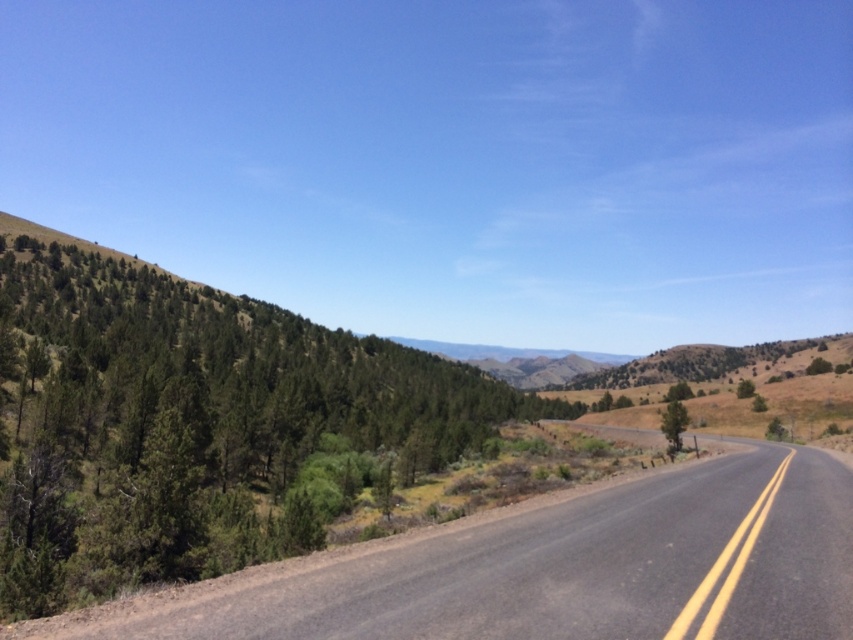
Between point (340, 376) and point (496, 616), which one is positioned in front?

Positioned in front is point (496, 616).

Consider the image. Who is taller, green leafy tree at left or black asphalt road at center?

Standing taller between the two is green leafy tree at left.

Does point (126, 432) come farther from viewer compared to point (747, 632)?

Yes, point (126, 432) is behind point (747, 632).

Find the location of a particular element. green leafy tree at left is located at coordinates (196, 424).

Does black asphalt road at center lie behind green matte tree at center-right?

No, black asphalt road at center is closer to the viewer.

Can you confirm if black asphalt road at center is smaller than green matte tree at center-right?

Indeed, black asphalt road at center has a smaller size compared to green matte tree at center-right.

Which is in front, point (415, 602) or point (668, 403)?

Point (415, 602) is in front.

Find the location of a particular element. The height and width of the screenshot is (640, 853). black asphalt road at center is located at coordinates (552, 570).

Is point (44, 275) positioned in front of point (676, 448)?

No, it is not.

In order to click on green leafy tree at left in this screenshot , I will do `click(196, 424)`.

Image resolution: width=853 pixels, height=640 pixels. What are the coordinates of `green leafy tree at left` in the screenshot? It's located at (196, 424).